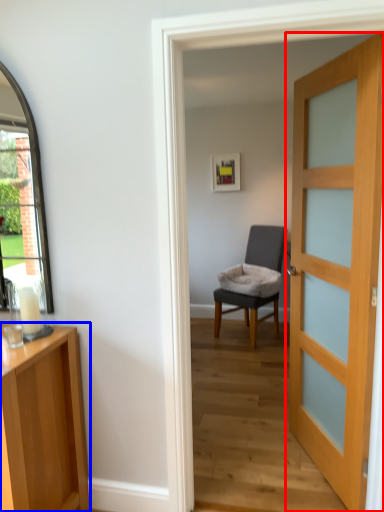
Question: Among these objects, which one is farthest to the camera, door (highlighted by a red box) or cabinetry (highlighted by a blue box)?

Choices:
 (A) door
 (B) cabinetry

Answer: (A)